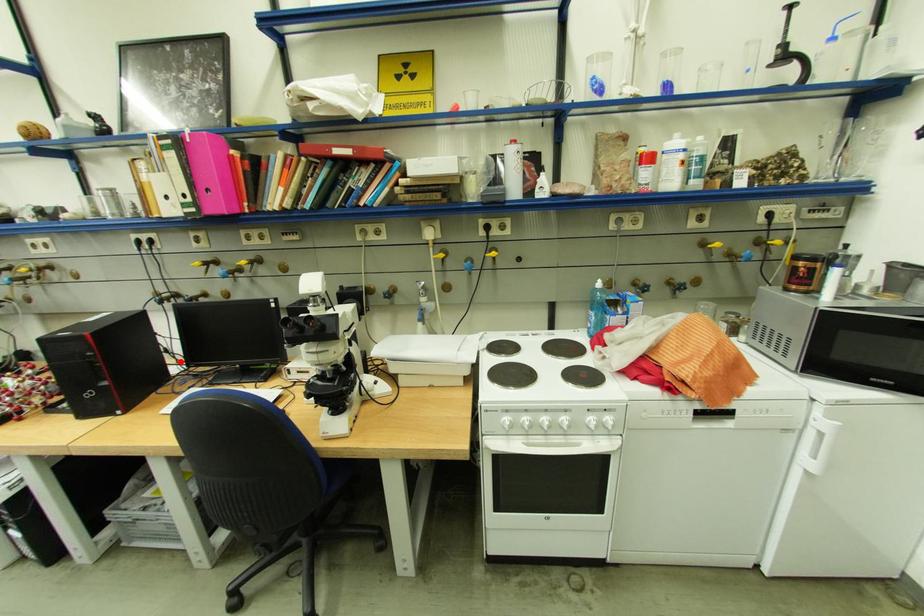
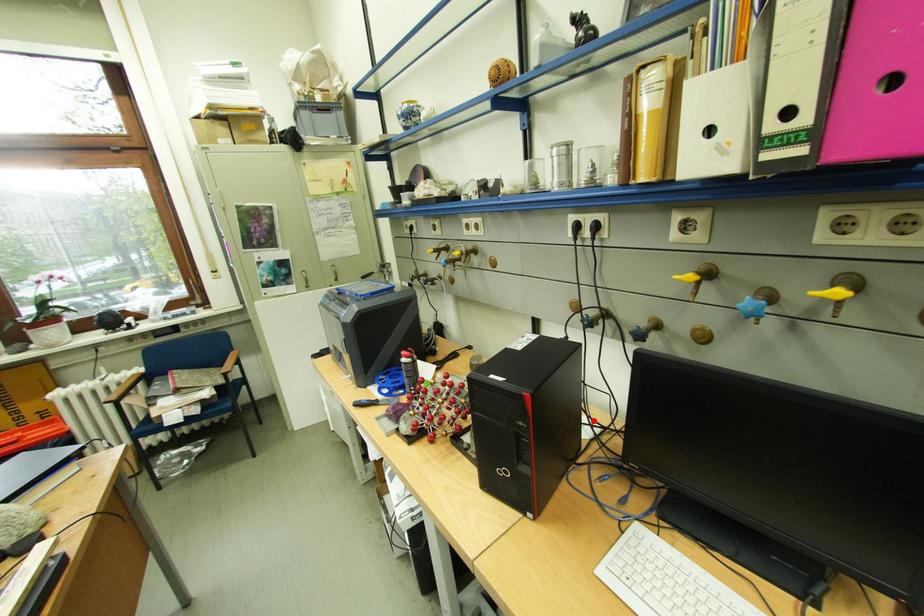
I am providing you with two images of the same scene from different viewpoints. A red point is marked on the first image and another point is marked on the second image. Is the red point in image1 aligned with the point shown in image2?

Yes